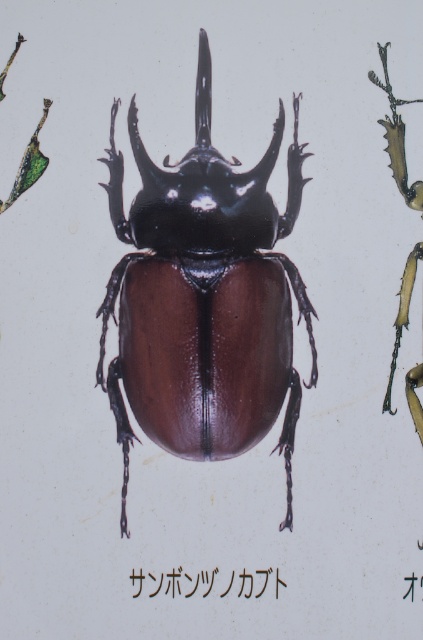
You are an entomologist examining two beetles in a collection. You have a shiny brown beetle at center and a black glossy beetle at center. Which beetle has a greater width?

The shiny brown beetle at center has a greater width than the black glossy beetle at center according to the description.

You are an entomologist examining the Three horned beetle. You notice two points on its body labeled as point (211, 326) and point (238, 593). Which point is closer to your eyes?

Point (211, 326) is closer to the viewer than point (238, 593).

You are an entomologist examining two beetles in a display case. You have the shiny brown beetle at center and the black glossy beetle at center. Which beetle is positioned more to the left?

The shiny brown beetle at center is positioned more to the left than the black glossy beetle at center.